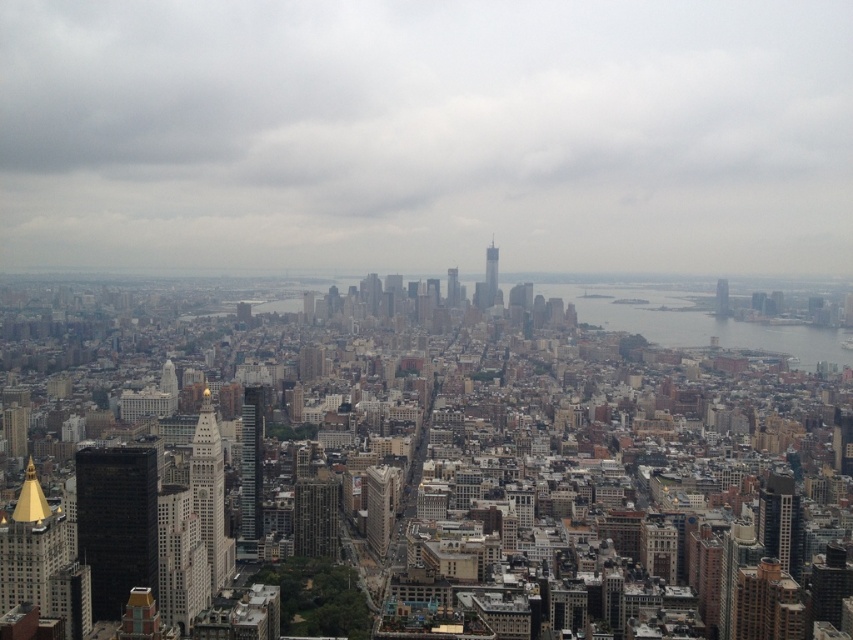
You are standing at point A located at coordinates point A at (393, 512). You want to walk to point B, which is 2080.31 feet away. Considering the city layout described, is this distance realistic for a straight path between two points in this urban area?

The distance between point A at (393, 512) and point B is 2080.31 feet. In an urban area with buildings and streets, a straight path might not be possible, but the distance itself is plausible for two points separated by several city blocks.

You are an architect evaluating the cityscape. Which of the two central structures, the white marble tower at center or the glassy steel skyscraper at center, has a greater overall size?

The white marble tower at center is bigger than the glassy steel skyscraper at center, so it has a greater overall size.

You are a city planner analyzing the urban layout. Given the brick building at center and the matte glass skyscraper at right, which one has a greater footprint in terms of physical space occupied?

The brick building at center is larger in size than the matte glass skyscraper at right, so it occupies more physical space.